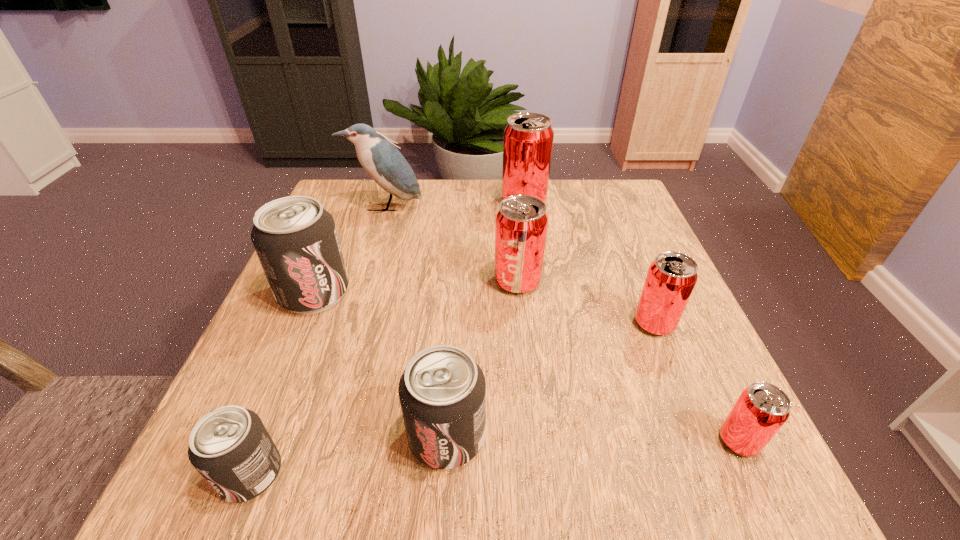
This screenshot has width=960, height=540. I want to click on bird at the left edge, so click(383, 162).

The width and height of the screenshot is (960, 540). Find the location of `object present at the far left corner`. object present at the far left corner is located at coordinates (383, 162).

Where is `object at the near left corner`? The height and width of the screenshot is (540, 960). object at the near left corner is located at coordinates (230, 447).

In order to click on object that is positioned at the near right corner in this screenshot , I will do `click(761, 410)`.

Where is `vacant space at the far edge of the desktop`? vacant space at the far edge of the desktop is located at coordinates (492, 226).

In the image, there is a desktop. In order to click on vacant space at the near edge in this screenshot , I will do `click(557, 451)`.

This screenshot has width=960, height=540. In the image, there is a desktop. Find the location of `vacant space at the left edge`. vacant space at the left edge is located at coordinates (347, 230).

In the image, there is a desktop. Identify the location of free region at the right edge. The height and width of the screenshot is (540, 960). (x=636, y=296).

This screenshot has width=960, height=540. Identify the location of free location at the far left corner. (337, 195).

You are a GUI agent. You are given a task and a screenshot of the screen. Output one action in this format:
    pyautogui.click(x=<x>, y=<y>)
    Task: Click on the vacant space at the far right corner of the desktop
    The height and width of the screenshot is (540, 960).
    Given the screenshot: What is the action you would take?
    pyautogui.click(x=606, y=223)